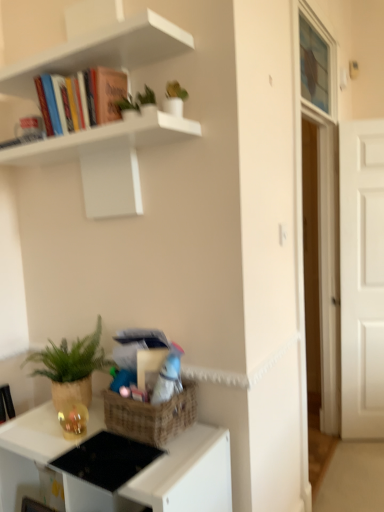
Question: Is white matte shelf at upper left oriented towards translucent glass window screen at upper right?

Choices:
 (A) no
 (B) yes

Answer: (A)

Question: Considering the relative positions of white matte shelf at upper left and translucent glass window screen at upper right in the image provided, is white matte shelf at upper left in front of translucent glass window screen at upper right?

Choices:
 (A) yes
 (B) no

Answer: (A)

Question: Can you confirm if white matte shelf at upper left is positioned to the right of translucent glass window screen at upper right?

Choices:
 (A) no
 (B) yes

Answer: (A)

Question: Is translucent glass window screen at upper right at the back of white matte shelf at upper left?

Choices:
 (A) no
 (B) yes

Answer: (B)

Question: Can you confirm if white matte shelf at upper left is shorter than translucent glass window screen at upper right?

Choices:
 (A) no
 (B) yes

Answer: (A)

Question: Is matte black desk at lower left in front of or behind translucent glass window screen at upper right in the image?

Choices:
 (A) front
 (B) behind

Answer: (A)

Question: From a real-world perspective, relative to translucent glass window screen at upper right, is matte black desk at lower left vertically above or below?

Choices:
 (A) above
 (B) below

Answer: (B)

Question: Considering the positions of point (185, 488) and point (317, 51), is point (185, 488) closer or farther from the camera than point (317, 51)?

Choices:
 (A) farther
 (B) closer

Answer: (B)

Question: In terms of width, does matte black desk at lower left look wider or thinner when compared to translucent glass window screen at upper right?

Choices:
 (A) wide
 (B) thin

Answer: (A)

Question: Is translucent glass window screen at upper right taller or shorter than green woven basket at lower left?

Choices:
 (A) tall
 (B) short

Answer: (A)

Question: Considering the positions of translucent glass window screen at upper right and green woven basket at lower left in the image, is translucent glass window screen at upper right wider or thinner than green woven basket at lower left?

Choices:
 (A) wide
 (B) thin

Answer: (B)

Question: Is translucent glass window screen at upper right inside or outside of green woven basket at lower left?

Choices:
 (A) inside
 (B) outside

Answer: (B)

Question: From a real-world perspective, is translucent glass window screen at upper right above or below green woven basket at lower left?

Choices:
 (A) above
 (B) below

Answer: (A)

Question: Is point (66, 58) closer or farther from the camera than point (152, 495)?

Choices:
 (A) closer
 (B) farther

Answer: (B)

Question: From a real-world perspective, is white matte shelf at upper left physically located above or below matte black desk at lower left?

Choices:
 (A) above
 (B) below

Answer: (A)